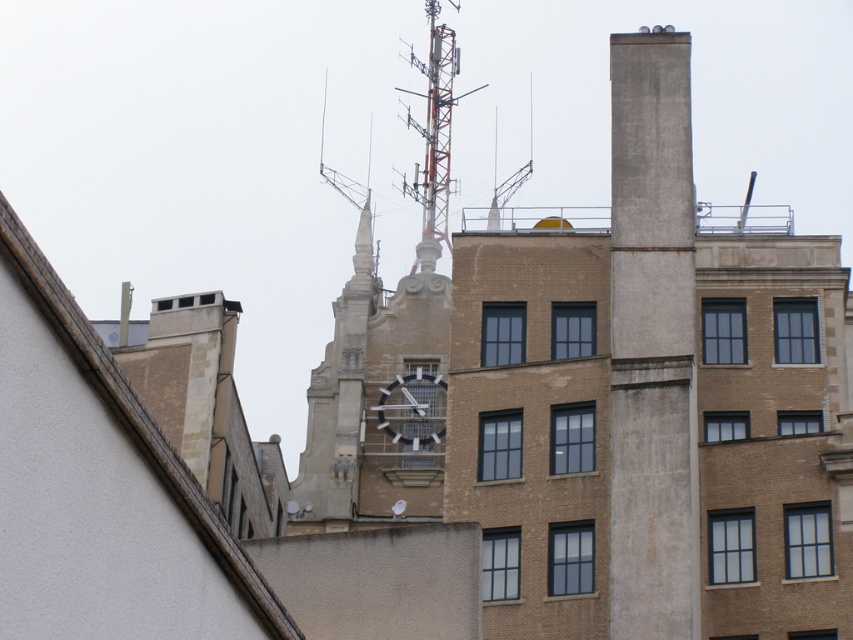
You are standing in front of the building and need to locate both the orange metallic antenna at upper center and the metallic gray clock at center. Which object is positioned to the left when viewed from your perspective?

The orange metallic antenna at upper center is positioned to the left of the metallic gray clock at center.

You are a window installer who needs to place a new window that is 2 meters wide. You have two options for placement on the building facade. The first option is next to the concrete chimney at right, and the second option is next to the metallic gray clock at center. Based on their sizes, which location would allow the window to fit better?

The concrete chimney at right has a larger size compared to the metallic gray clock at center, so placing the window next to the concrete chimney at right would allow for better fit since there is more space available.

You are standing in front of the building and notice two points marked on the facade. The first point is at coordinates point (630, 81) and the second is at point (445, 84). Which of these points is closer to your viewpoint?

Point (630, 81) is closer to the camera than point (445, 84).